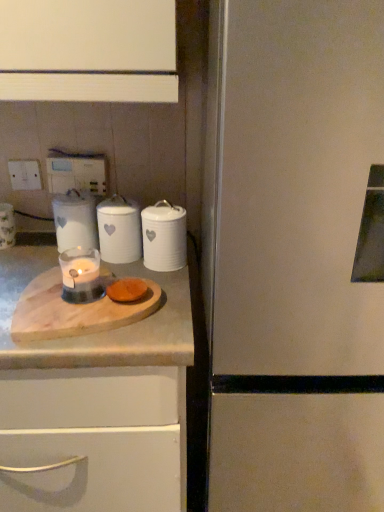
The image size is (384, 512). In order to click on free space to the left of white ceramic canister at center, the second kitchen appliance viewed from the right in this screenshot , I will do `click(34, 261)`.